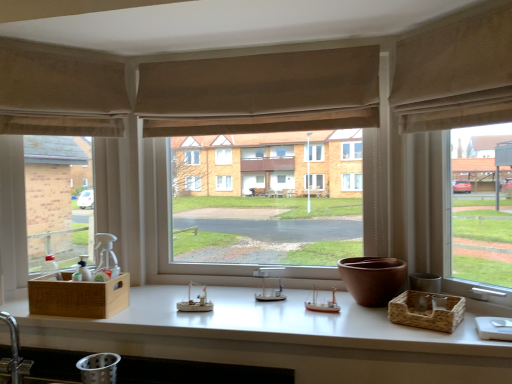
You are a GUI agent. You are given a task and a screenshot of the screen. Output one action in this format:
    pyautogui.click(x=<x>, y=<y>)
    Task: Click on the free space above wooden woven basket at left, which is the first basket from left to right (from a real-world perspective)
    The width and height of the screenshot is (512, 384).
    Given the screenshot: What is the action you would take?
    pyautogui.click(x=87, y=276)